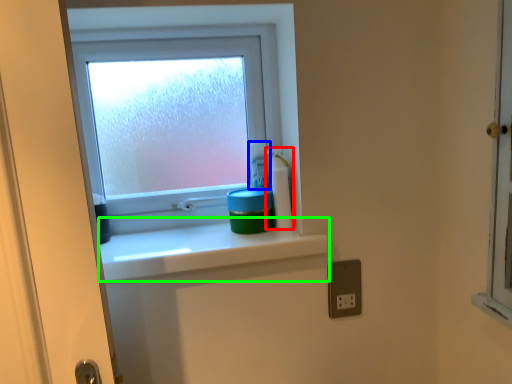
Question: Considering the real-world distances, which object is farthest from cleaning product (highlighted by a red box)? toiletry (highlighted by a blue box) or window sill (highlighted by a green box)?

Choices:
 (A) toiletry
 (B) window sill

Answer: (B)